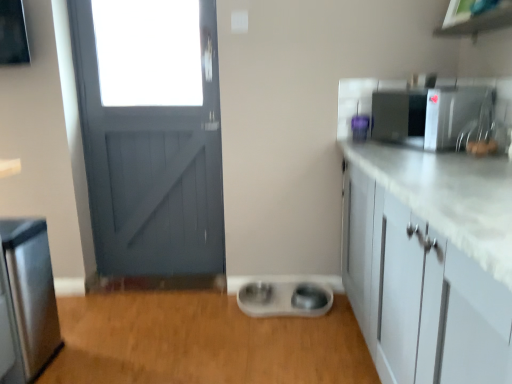
Question: Do you think stainless steel refrigerator at left, which is counted as the first appliance, starting from the left, is within satin silver microwave at upper right, marked as the third appliance in a left-to-right arrangement, or outside of it?

Choices:
 (A) outside
 (B) inside

Answer: (A)

Question: In terms of size, does stainless steel refrigerator at left, which is counted as the 1th appliance, starting from the bottom, appear bigger or smaller than satin silver microwave at upper right, acting as the 1th appliance starting from the right?

Choices:
 (A) big
 (B) small

Answer: (A)

Question: Based on their relative distances, which object is nearer to the satin nickel faucet at upper right?

Choices:
 (A) purple plastic container at upper right, the 2th appliance positioned from the right
 (B) satin silver microwave at upper right, acting as the 1th appliance starting from the right
 (C) stainless steel refrigerator at left, placed as the 3th appliance when sorted from top to bottom
 (D) white plastic pet bowls at center

Answer: (B)

Question: Based on their relative distances, which object is farther from the satin silver microwave at upper right, acting as the 1th appliance starting from the right?

Choices:
 (A) satin nickel faucet at upper right
 (B) white plastic pet bowls at center
 (C) stainless steel refrigerator at left, placed as the 3th appliance when sorted from top to bottom
 (D) purple plastic container at upper right, the 2th appliance positioned from the right

Answer: (C)